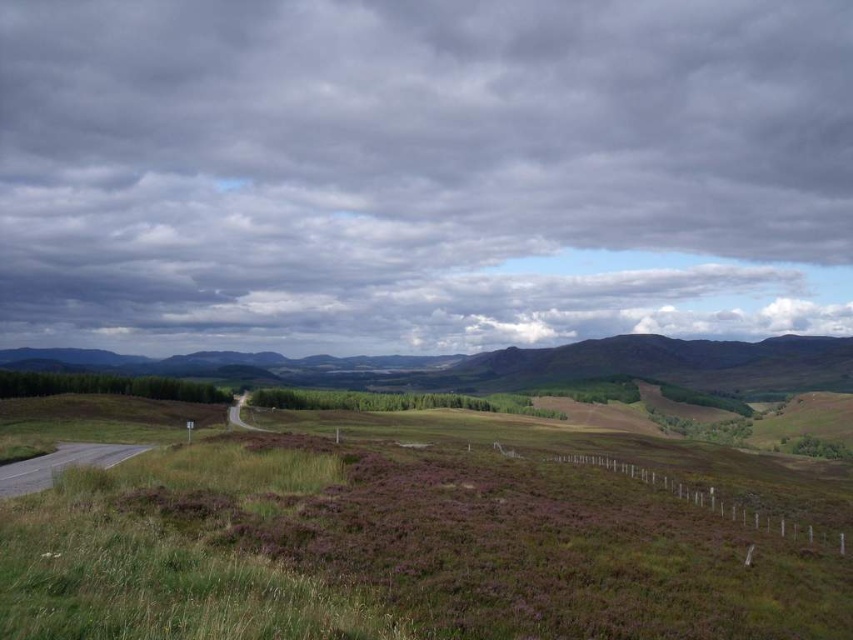
Is cloudy sky at upper center closer to camera compared to green grassy field at lower left?

No, it is not.

Does cloudy sky at upper center appear over green grassy field at lower left?

Correct, cloudy sky at upper center is located above green grassy field at lower left.

You are a GUI agent. You are given a task and a screenshot of the screen. Output one action in this format:
    pyautogui.click(x=<x>, y=<y>)
    Task: Click on the cloudy sky at upper center
    This screenshot has width=853, height=640.
    Given the screenshot: What is the action you would take?
    pyautogui.click(x=421, y=172)